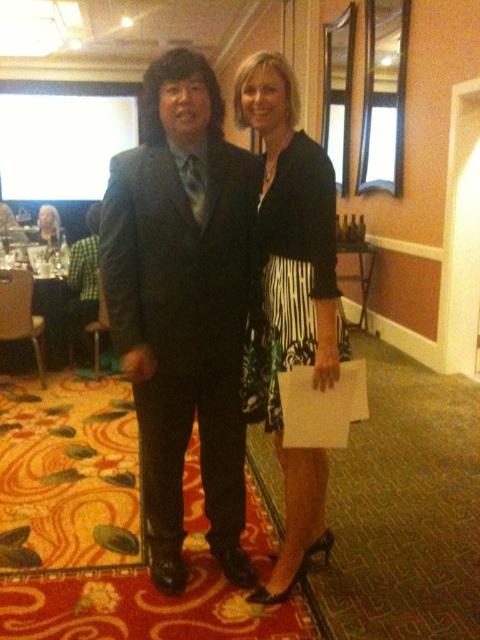
This screenshot has height=640, width=480. Describe the element at coordinates (288, 275) in the screenshot. I see `black and white striped dress at center` at that location.

Does point (313, 234) come farther from viewer compared to point (51, 227)?

No.

Locate an element on the screen. This screenshot has width=480, height=640. black and white striped dress at center is located at coordinates (288, 275).

Is black satin dress at center to the left of matte black dress at center from the viewer's perspective?

In fact, black satin dress at center is to the right of matte black dress at center.

Does black satin dress at center have a smaller size compared to matte black dress at center?

Actually, black satin dress at center might be larger than matte black dress at center.

Between point (299, 168) and point (60, 237), which one is positioned behind?

Positioned behind is point (60, 237).

Locate an element on the screen. This screenshot has width=480, height=640. black satin dress at center is located at coordinates [x=290, y=300].

Can you confirm if shiny black suit at center is positioned above matte black dress at center?

Actually, shiny black suit at center is below matte black dress at center.

Does shiny black suit at center have a greater width compared to matte black dress at center?

Correct, the width of shiny black suit at center exceeds that of matte black dress at center.

Describe the element at coordinates (182, 305) in the screenshot. The height and width of the screenshot is (640, 480). I see `shiny black suit at center` at that location.

Where is `shiny black suit at center`? shiny black suit at center is located at coordinates (182, 305).